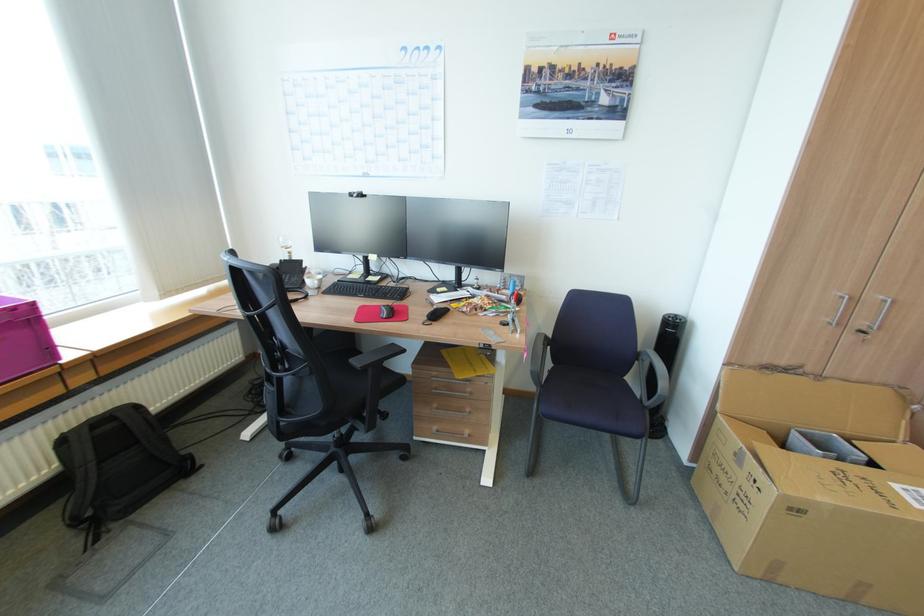
This screenshot has width=924, height=616. I want to click on blue chair sitting surface, so click(x=578, y=392).